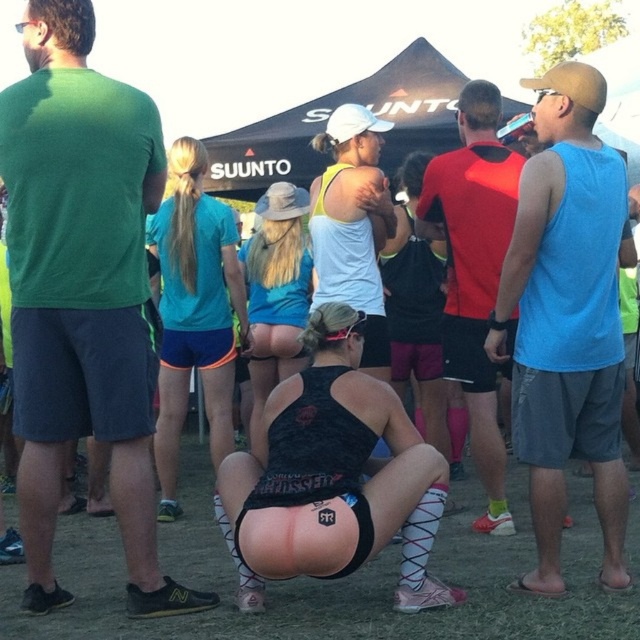
You are a photographer at the event and need to capture a photo of the black matte tank top at center and the teal fabric shorts at center. Based on their positions, which clothing item is closer to the camera?

The black matte tank top at center is positioned under the teal fabric shorts at center, so the black matte tank top at center is closer to the camera.

What are the coordinates of the black matte tank top at center?

The coordinates of the black matte tank top at center are at point (x=337, y=474).